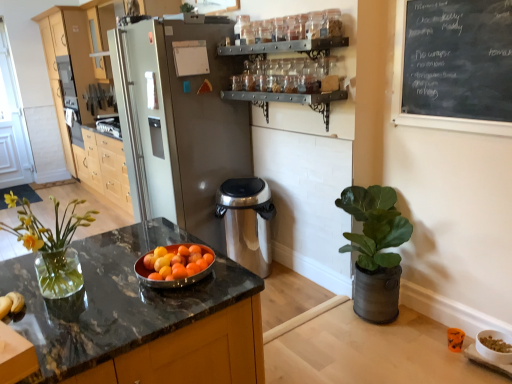
Question: From the image's perspective, is light wood cabinetry at left beneath stainless steel trash can at center?

Choices:
 (A) no
 (B) yes

Answer: (A)

Question: Is light wood cabinetry at left facing towards stainless steel trash can at center?

Choices:
 (A) yes
 (B) no

Answer: (B)

Question: From the image's perspective, is light wood cabinetry at left over stainless steel trash can at center?

Choices:
 (A) no
 (B) yes

Answer: (B)

Question: Is light wood cabinetry at left not within stainless steel trash can at center?

Choices:
 (A) no
 (B) yes

Answer: (B)

Question: Does light wood cabinetry at left lie in front of stainless steel trash can at center?

Choices:
 (A) yes
 (B) no

Answer: (B)

Question: Is satin silver refrigerator at center taller or shorter than black chalkboard at upper right?

Choices:
 (A) tall
 (B) short

Answer: (A)

Question: From a real-world perspective, relative to black chalkboard at upper right, is satin silver refrigerator at center vertically above or below?

Choices:
 (A) above
 (B) below

Answer: (B)

Question: Visually, is satin silver refrigerator at center positioned to the left or to the right of black chalkboard at upper right?

Choices:
 (A) right
 (B) left

Answer: (B)

Question: Is satin silver refrigerator at center inside or outside of black chalkboard at upper right?

Choices:
 (A) inside
 (B) outside

Answer: (B)

Question: From a real-world perspective, is black chalkboard at upper right physically located above or below black marble countertop at center?

Choices:
 (A) above
 (B) below

Answer: (A)

Question: Considering their positions, is black chalkboard at upper right located in front of or behind black marble countertop at center?

Choices:
 (A) front
 (B) behind

Answer: (B)

Question: From the image's perspective, is black chalkboard at upper right positioned above or below black marble countertop at center?

Choices:
 (A) above
 (B) below

Answer: (A)

Question: Visually, is black chalkboard at upper right positioned to the left or to the right of black marble countertop at center?

Choices:
 (A) left
 (B) right

Answer: (B)

Question: From a real-world perspective, relative to black chalkboard at upper right, is white glossy bowl at lower right vertically above or below?

Choices:
 (A) below
 (B) above

Answer: (A)

Question: Relative to black chalkboard at upper right, is white glossy bowl at lower right in front or behind?

Choices:
 (A) front
 (B) behind

Answer: (B)